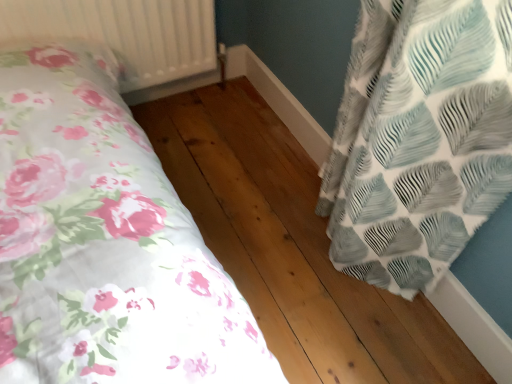
Locate an element on the screen. Image resolution: width=512 pixels, height=384 pixels. vacant space situated above natural wood flooring at center (from a real-world perspective) is located at coordinates (331, 131).